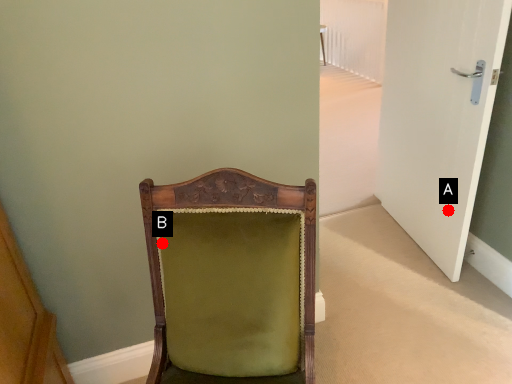
Question: Two points are circled on the image, labeled by A and B beside each circle. Which point is further to the camera?

Choices:
 (A) A is further
 (B) B is further

Answer: (A)